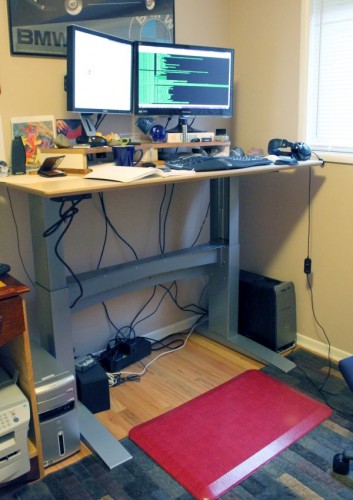
I want to click on computer monitor, so click(105, 76), click(185, 75).